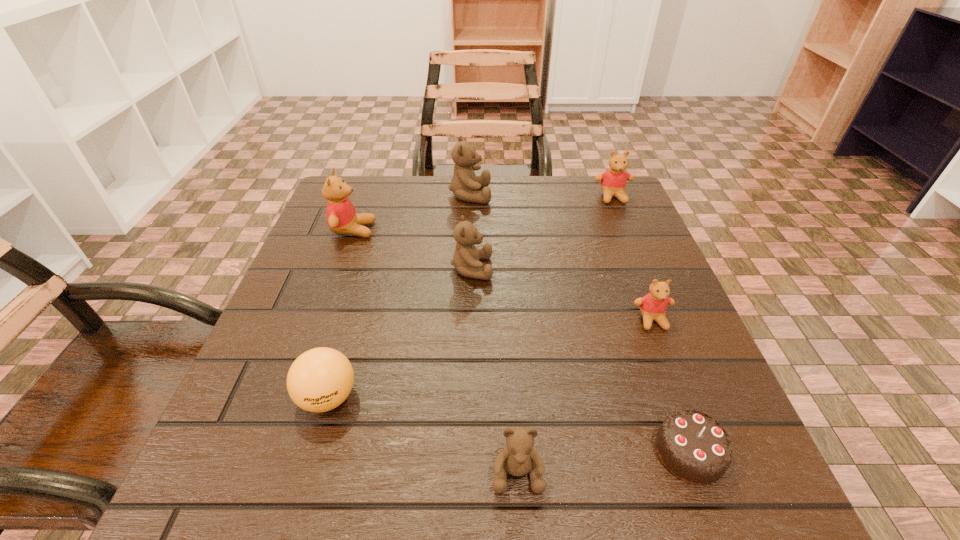
Where is `brown teddy bear object that ranks as the closest to the shortest object`? brown teddy bear object that ranks as the closest to the shortest object is located at coordinates (518, 458).

This screenshot has height=540, width=960. I want to click on red teddy bear that can be found as the second closest to the second biggest red teddy bear, so click(x=341, y=216).

Identify which red teddy bear is the second closest to the ping-pong ball. Please provide its 2D coordinates. Your answer should be formatted as a tuple, i.e. [(x, y)], where the tuple contains the x and y coordinates of a point satisfying the conditions above.

[(653, 306)]

Image resolution: width=960 pixels, height=540 pixels. I want to click on free spot that satisfies the following two spatial constraints: 1. on the front-facing side of the shortest object; 2. on the right side of the leftmost teddy bear, so click(x=274, y=453).

Image resolution: width=960 pixels, height=540 pixels. I want to click on vacant space that satisfies the following two spatial constraints: 1. on the front-facing side of the second biggest brown teddy bear; 2. on the back side of the shortest object, so click(x=468, y=453).